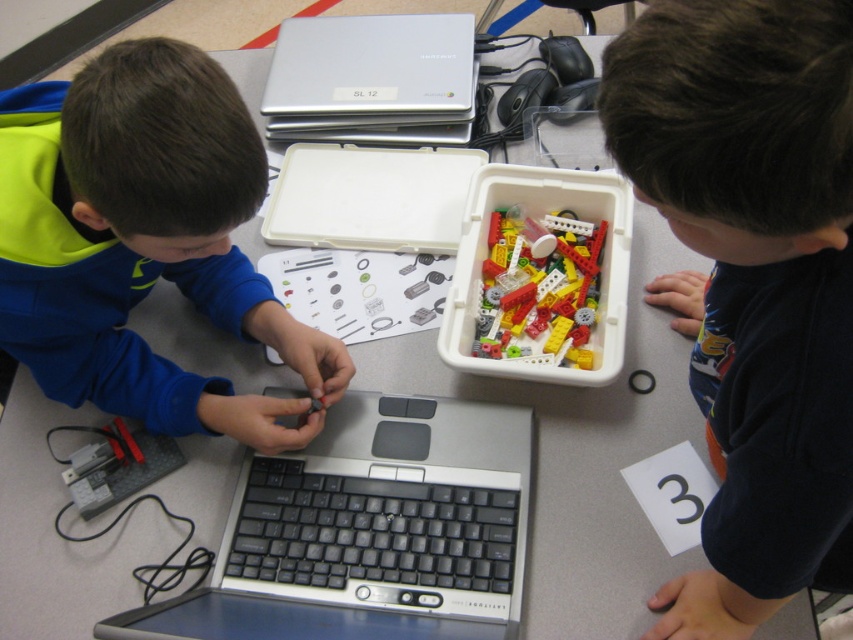
Question: Does dark blue fabric at lower right lie in front of translucent plastic lego pieces at center?

Choices:
 (A) no
 (B) yes

Answer: (B)

Question: Based on their relative distances, which object is nearer to the silver metallic laptop at upper center?

Choices:
 (A) blue matte shirt at left
 (B) silver/black keyboard at center
 (C) dark blue fabric at lower right
 (D) translucent plastic lego pieces at center

Answer: (D)

Question: Does silver metallic laptop at upper center come behind translucent plastic lego pieces at center?

Choices:
 (A) no
 (B) yes

Answer: (B)

Question: Which point is closer to the camera?

Choices:
 (A) silver/black keyboard at center
 (B) silver metallic laptop at upper center
 (C) dark blue fabric at lower right

Answer: (C)

Question: Does dark blue fabric at lower right appear on the left side of silver/black keyboard at center?

Choices:
 (A) no
 (B) yes

Answer: (A)

Question: Which point appears farthest from the camera in this image?

Choices:
 (A) (67, 144)
 (B) (738, 420)
 (C) (378, 467)

Answer: (C)